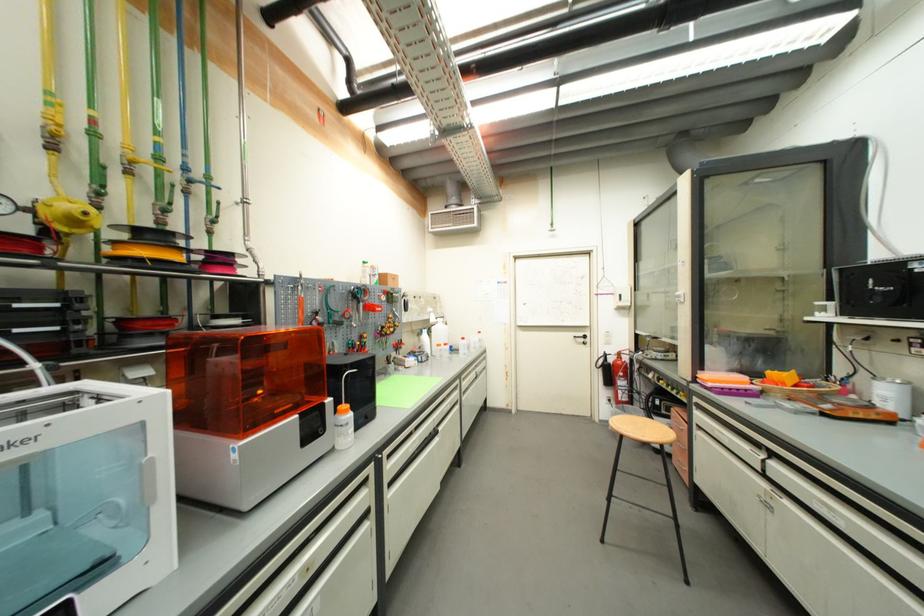
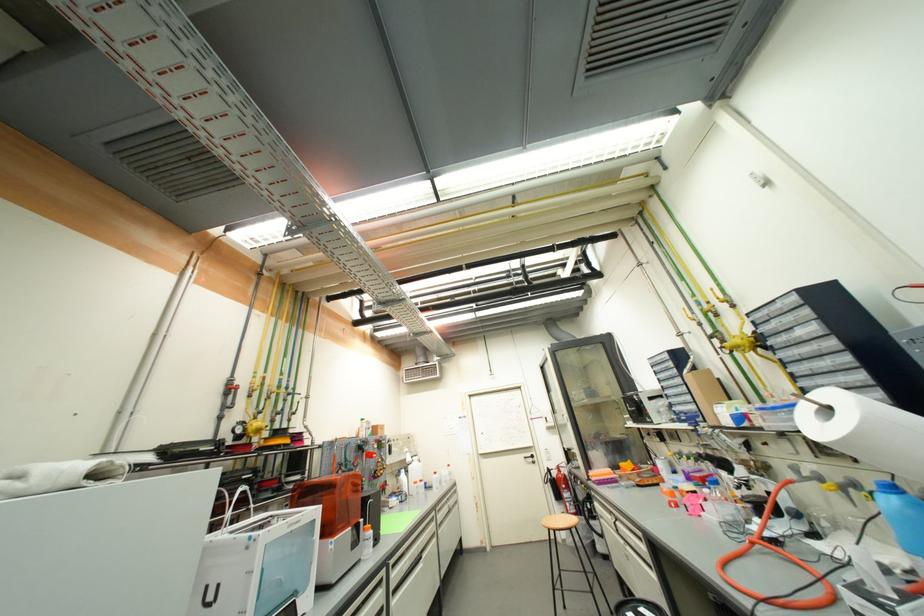
Locate, in the second image, the point that corresponds to (613,355) in the first image.

(554, 469)